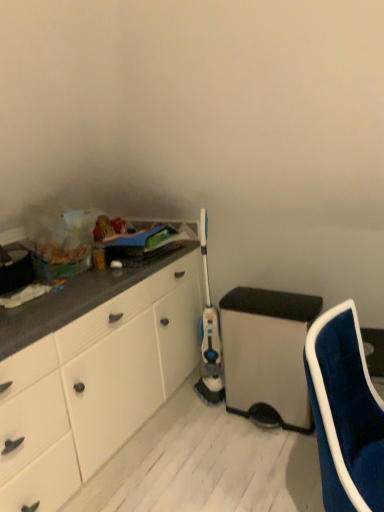
I want to click on free space in front of matte plastic trash can at lower right, so click(x=263, y=462).